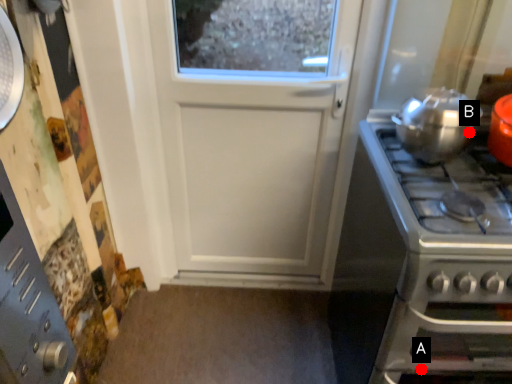
Question: Two points are circled on the image, labeled by A and B beside each circle. Which point is further to the camera?

Choices:
 (A) A is further
 (B) B is further

Answer: (B)